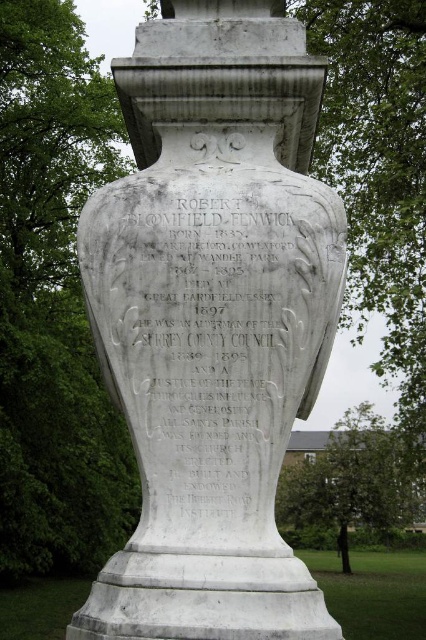
You are a photographer standing in front of the white marble vase at center and the green leafy tree at center. You want to capture a photo where both objects are in focus. Which object should you focus on to ensure both are sharp?

You should focus on the white marble vase at center because it might be wider than the green leafy tree at center, so focusing on the wider object increases the chances of both being in focus.

You are an artist trying to sketch the monument. You need to know which part of the monument is taller between the white marble vase at center and the white marble text at center. Which one is taller?

The white marble vase at center is taller than the white marble text at center.

You are standing in front of the monument and want to read the text. Is the white marble text at center visible above the green leafy tree at center?

The white marble text at center is positioned over the green leafy tree at center, so yes, the text is visible above the tree.